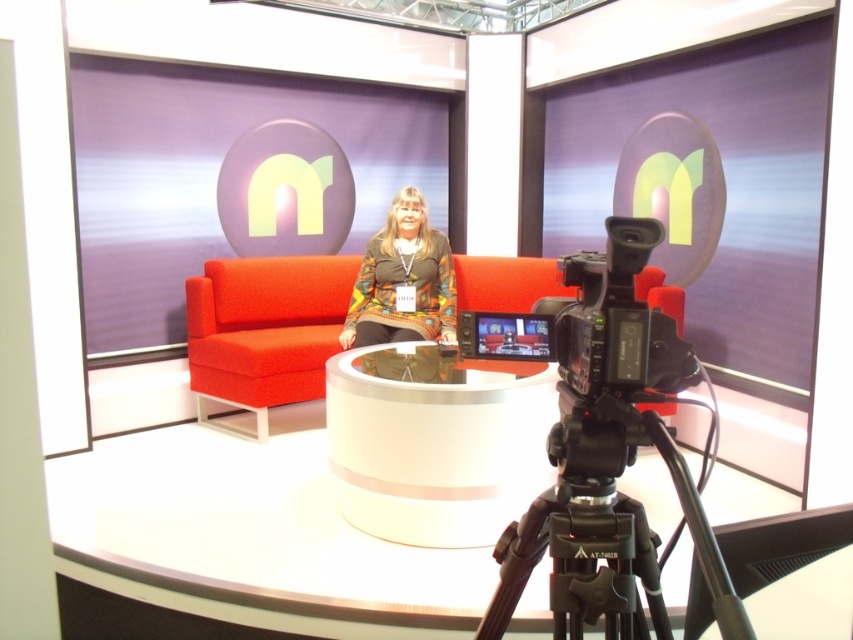
Is point (582, 605) positioned before point (636, 285)?

That is True.

Does black plastic tripod at lower center appear on the left side of velvet orange couch at center?

Incorrect, black plastic tripod at lower center is not on the left side of velvet orange couch at center.

In order to click on black plastic tripod at lower center in this screenshot , I will do `click(604, 532)`.

Between black plastic tripod at lower center and knitted sweater at center, which one is positioned higher?

knitted sweater at center

Is point (537, 513) less distant than point (415, 189)?

Yes, point (537, 513) is in front of point (415, 189).

Does point (648, 589) lie in front of point (376, 320)?

Yes.

Find the location of a particular element. The image size is (853, 640). black plastic tripod at lower center is located at coordinates (604, 532).

Which is behind, point (682, 312) or point (399, 256)?

The point (399, 256) is behind.

Locate an element on the screen. This screenshot has height=640, width=853. velvet orange couch at center is located at coordinates (265, 326).

Where is `velvet orange couch at center`? The image size is (853, 640). velvet orange couch at center is located at coordinates (265, 326).